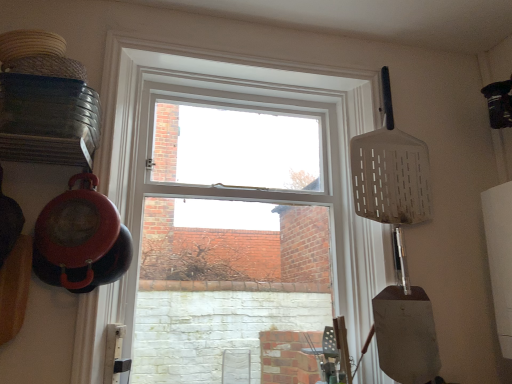
Question: Should I look upward or downward to see white plastic spatula at upper right?

Choices:
 (A) down
 (B) up

Answer: (B)

Question: Considering the relative positions of metallic silver shovel at right and clear glass window at center in the image provided, is metallic silver shovel at right to the right of clear glass window at center from the viewer's perspective?

Choices:
 (A) yes
 (B) no

Answer: (A)

Question: Considering the relative sizes of metallic silver shovel at right and clear glass window at center in the image provided, is metallic silver shovel at right wider than clear glass window at center?

Choices:
 (A) no
 (B) yes

Answer: (A)

Question: Is metallic silver shovel at right closer to the viewer compared to clear glass window at center?

Choices:
 (A) no
 (B) yes

Answer: (A)

Question: Is metallic silver shovel at right not within clear glass window at center?

Choices:
 (A) no
 (B) yes

Answer: (B)

Question: Is clear glass window at center inside metallic silver shovel at right?

Choices:
 (A) no
 (B) yes

Answer: (A)

Question: Is metallic silver shovel at right further to camera compared to clear glass window at center?

Choices:
 (A) yes
 (B) no

Answer: (A)

Question: Is metallic silver shovel at right taller than white plastic spatula at upper right?

Choices:
 (A) yes
 (B) no

Answer: (B)

Question: From the image's perspective, is metallic silver shovel at right below white plastic spatula at upper right?

Choices:
 (A) no
 (B) yes

Answer: (B)

Question: Is white plastic spatula at upper right at the back of metallic silver shovel at right?

Choices:
 (A) no
 (B) yes

Answer: (A)

Question: Is metallic silver shovel at right to the right of white plastic spatula at upper right from the viewer's perspective?

Choices:
 (A) yes
 (B) no

Answer: (B)

Question: Is metallic silver shovel at right smaller than white plastic spatula at upper right?

Choices:
 (A) yes
 (B) no

Answer: (A)

Question: Can you confirm if metallic silver shovel at right is thinner than white plastic spatula at upper right?

Choices:
 (A) yes
 (B) no

Answer: (B)

Question: Is clear glass window at center to the left of white plastic spatula at upper right from the viewer's perspective?

Choices:
 (A) no
 (B) yes

Answer: (B)